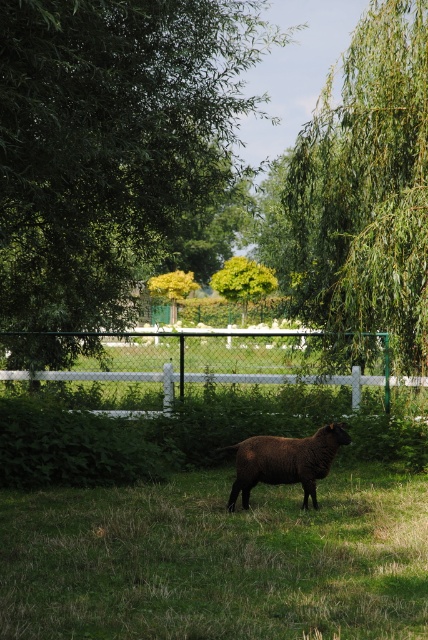
Who is positioned more to the right, green leafy tree at upper center or white wooden fence at center?

From the viewer's perspective, green leafy tree at upper center appears more on the right side.

Describe the element at coordinates (115, 147) in the screenshot. I see `green leafy tree at upper center` at that location.

Image resolution: width=428 pixels, height=640 pixels. What are the coordinates of `green leafy tree at upper center` in the screenshot? It's located at (115, 147).

Is point (401, 188) positioned after point (321, 467)?

Yes, it is behind point (321, 467).

Who is more forward, (306, 224) or (332, 445)?

Point (332, 445) is more forward.

Identify the location of green leafy willow at upper right. The image size is (428, 640). (366, 188).

Who is taller, green leafy tree at upper center or green leafy willow at upper right?

green leafy tree at upper center

Describe the element at coordinates (115, 147) in the screenshot. I see `green leafy tree at upper center` at that location.

Is point (139, 99) positioned behind point (419, 176)?

That is False.

Find the location of a particular element. Image resolution: width=428 pixels, height=640 pixels. green leafy tree at upper center is located at coordinates (115, 147).